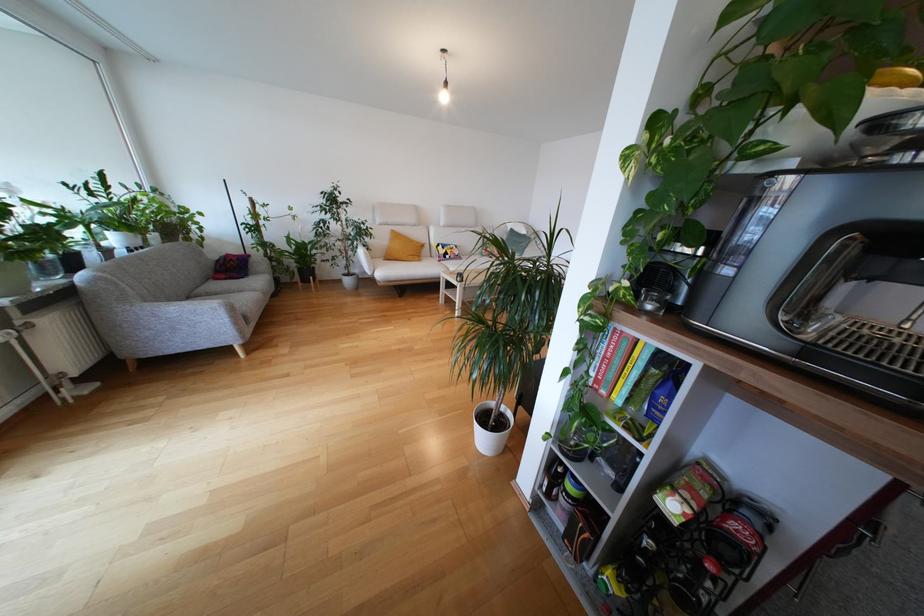
Find the location of a particular element. This screenshot has height=616, width=924. radiator valve is located at coordinates (8, 358).